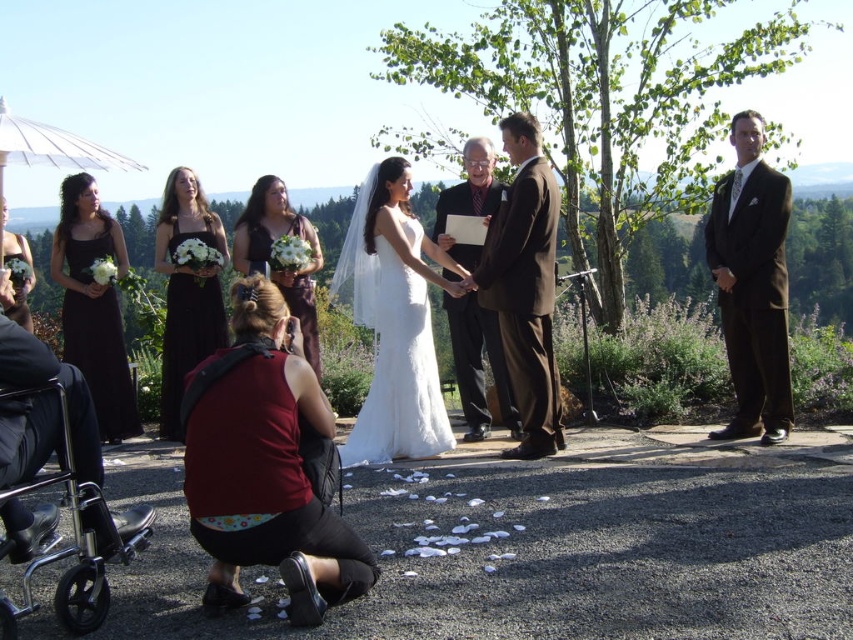
What are the coordinates of the black satin dress at center in the image?

The black satin dress at center is located at coordinates point (187, 291).

You are a photographer at the wedding ceremony. You need to capture a photo that includes both the white satin dress at center and the black satin dress at left. Considering their positions and sizes, which dress should you focus on first to ensure both are in frame?

The white satin dress at center might be wider than the black satin dress at left, so focusing on the white satin dress at center first would help ensure both are in frame as it occupies more space.

You are a photographer at the wedding ceremony. You need to capture a photo of the groom in the brown suit at right and the officiant in the brown textured suit at center. Based on their heights, which one should you adjust the camera angle to focus on first to ensure both are in frame?

The brown suit at right is taller than the brown textured suit at center, so you should focus on the groom in the brown suit at right first to ensure the camera angle accommodates his height, then adjust slightly downward for the officiant in the brown textured suit at center.